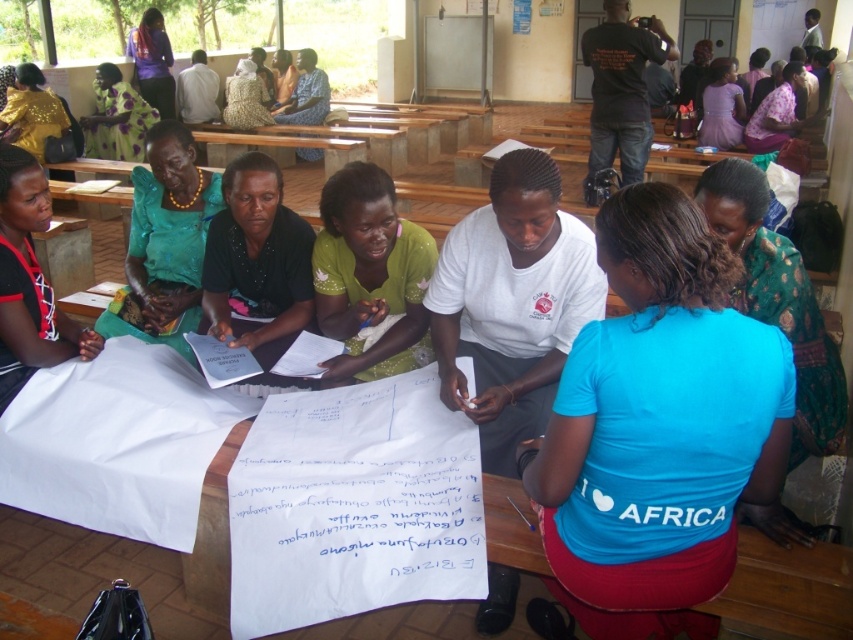
From the picture: You are organizing a fashion show and need to arrange the green sequined dress at center and the black cotton shirt at upper right on a runway. Which garment should be placed first if you want to display the larger item closer to the audience?

The black cotton shirt at upper right should be placed first because it is larger than the green sequined dress at center, ensuring the bigger item is closer to the audience.